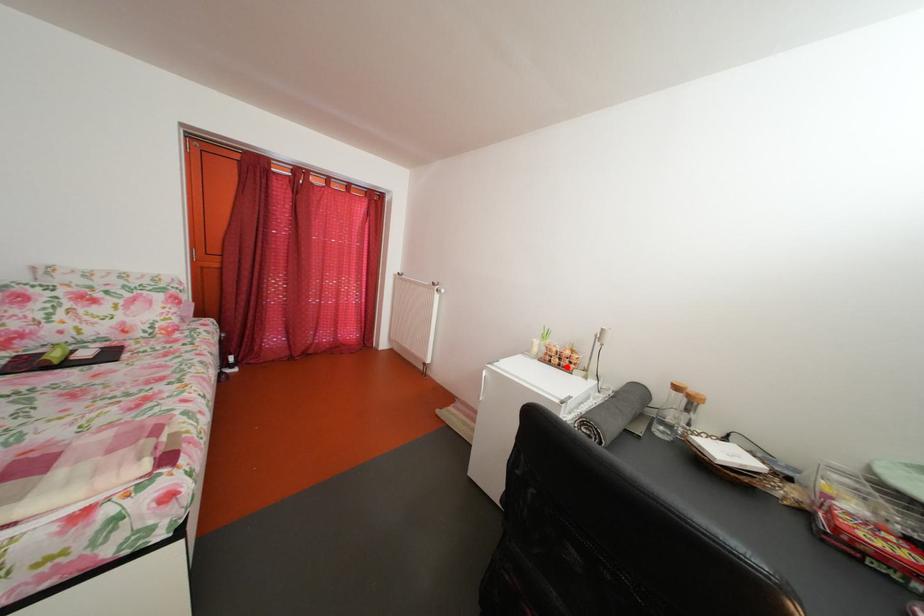
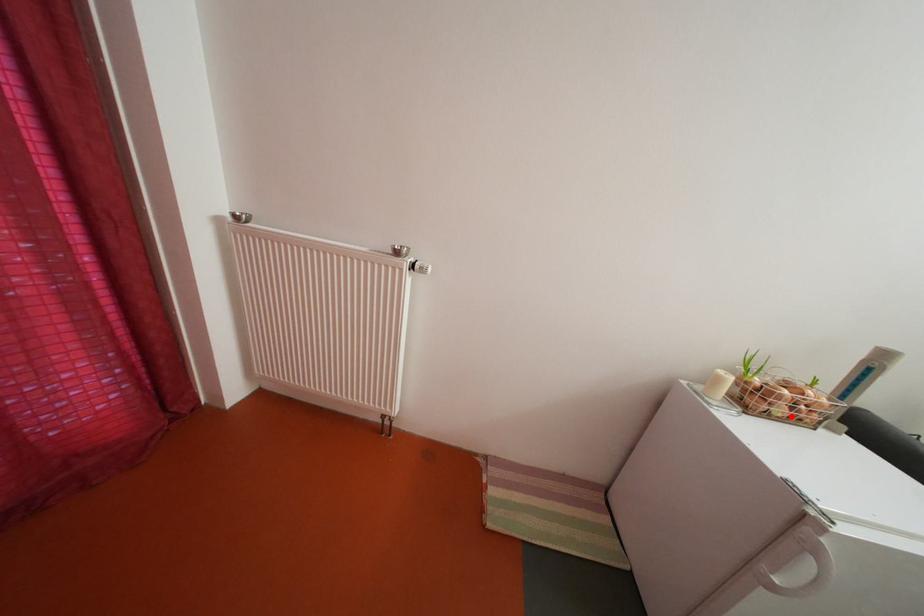
I am providing you with two images of the same scene from different viewpoints. A red point is marked on the first image and another point is marked on the second image. Does the point marked in image1 correspond to the same location as the one in image2?

Yes